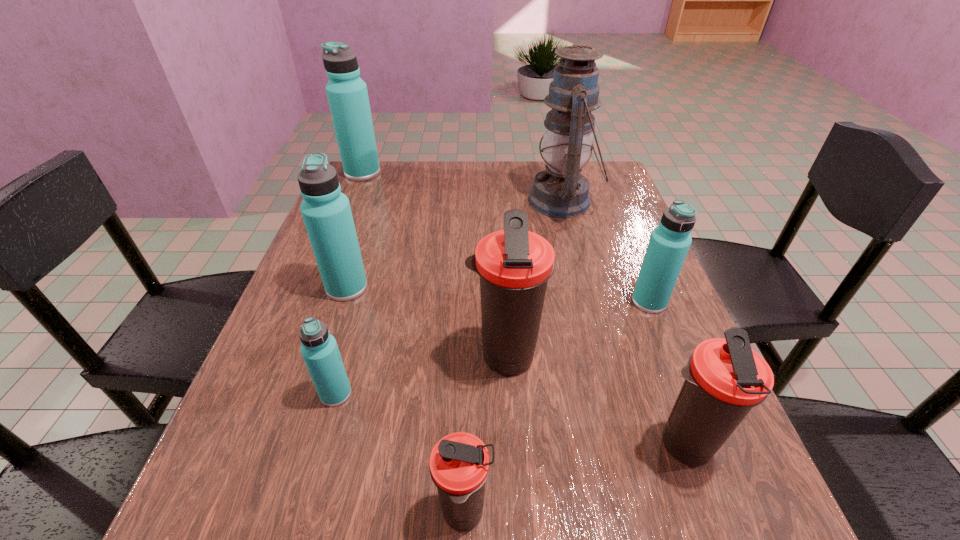
Where is `oil lamp`? The height and width of the screenshot is (540, 960). oil lamp is located at coordinates (560, 191).

The image size is (960, 540). Identify the location of the farthest thermos bottle. (347, 94).

Locate an element on the screen. This screenshot has width=960, height=540. the biggest aqua thermos bottle is located at coordinates (347, 94).

Locate an element on the screen. The width and height of the screenshot is (960, 540). the biggest brown thermos bottle is located at coordinates (514, 265).

Where is `the second biggest aqua thermos bottle`? the second biggest aqua thermos bottle is located at coordinates (326, 211).

Find the location of a particular element. The image size is (960, 540). the second smallest brown thermos bottle is located at coordinates (724, 378).

What are the coordinates of `the rightmost brown thermos bottle` in the screenshot? It's located at (724, 378).

Locate an element on the screen. the rightmost aqua thermos bottle is located at coordinates (669, 243).

Locate an element on the screen. The height and width of the screenshot is (540, 960). the nearest aqua thermos bottle is located at coordinates (319, 349).

The image size is (960, 540). In order to click on vacant space located on the front of the oil lamp in this screenshot , I will do `click(581, 269)`.